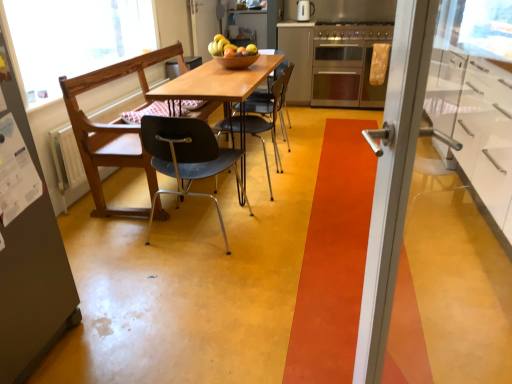
Question: Is stainless steel oven at center wider or thinner than matte black chair at center, positioned as the third chair in back-to-front order?

Choices:
 (A) thin
 (B) wide

Answer: (B)

Question: Considering the relative positions of stainless steel oven at center and matte black chair at center, the first chair positioned from the front, in the image provided, is stainless steel oven at center to the left or to the right of matte black chair at center, the first chair positioned from the front,?

Choices:
 (A) right
 (B) left

Answer: (A)

Question: Estimate the real-world distances between objects in this image. Which object is farther from the white glossy cabinet at right, marked as the 2th cabinetry in a top-to-bottom arrangement?

Choices:
 (A) matte silver kettle at upper center
 (B) stainless steel oven at center
 (C) matte black chair at center, the first chair positioned from the front
 (D) metallic blue chair at center, the 1th chair positioned from the back
 (E) orange carpet at center

Answer: (A)

Question: Which of these objects is positioned closest to the orange carpet at center?

Choices:
 (A) wooden bowl at center
 (B) shiny brown bowl at center
 (C) satin silver cabinet at center, the second cabinetry positioned from the right
 (D) matte silver kettle at upper center
 (E) white glossy cabinet at right, placed as the first cabinetry when sorted from right to left

Answer: (E)